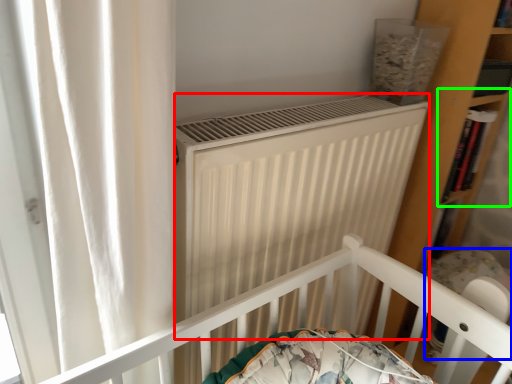
Question: Estimate the real-world distances between objects in this image. Which object is closer to heater (highlighted by a red box), baby carriage (highlighted by a blue box) or shelf (highlighted by a green box)?

Choices:
 (A) baby carriage
 (B) shelf

Answer: (A)